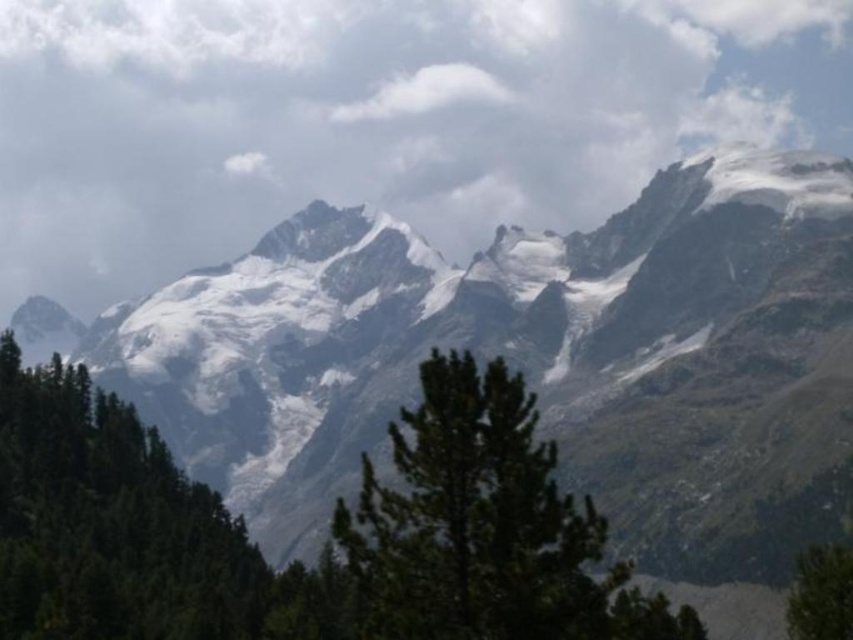
Which is below, green textured tree at center or green matte tree at lower right?

green matte tree at lower right is lower down.

Between green textured tree at center and green matte tree at lower right, which one has less height?

green matte tree at lower right

Which is behind, point (360, 531) or point (827, 579)?

Positioned behind is point (827, 579).

I want to click on green textured tree at center, so click(x=485, y=529).

Based on the photo, is green textured tree at center thinner than green matte tree at left?

Incorrect, green textured tree at center's width is not less than green matte tree at left's.

Which is behind, point (643, 621) or point (106, 528)?

Point (106, 528)

Image resolution: width=853 pixels, height=640 pixels. What do you see at coordinates (485, 529) in the screenshot?
I see `green textured tree at center` at bounding box center [485, 529].

Where is `green textured tree at center`? green textured tree at center is located at coordinates (485, 529).

What are the coordinates of `white snow-covered mountain range at center` in the screenshot? It's located at (531, 358).

Can you confirm if white snow-covered mountain range at center is shorter than green matte tree at left?

In fact, white snow-covered mountain range at center may be taller than green matte tree at left.

Who is more distant from viewer, (490, 296) or (223, 568)?

Positioned behind is point (490, 296).

Where is `white snow-covered mountain range at center`? The image size is (853, 640). white snow-covered mountain range at center is located at coordinates (531, 358).